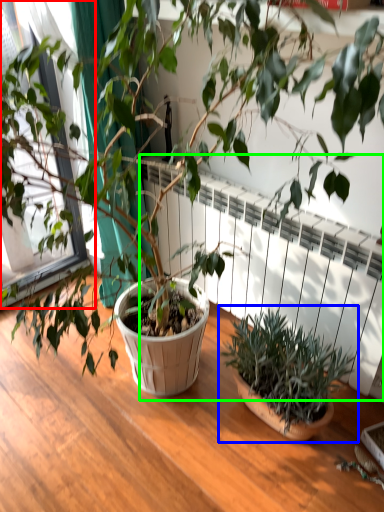
Question: Which is nearer to the window frame (highlighted by a red box)? houseplant (highlighted by a blue box) or radiator (highlighted by a green box).

Choices:
 (A) houseplant
 (B) radiator

Answer: (B)